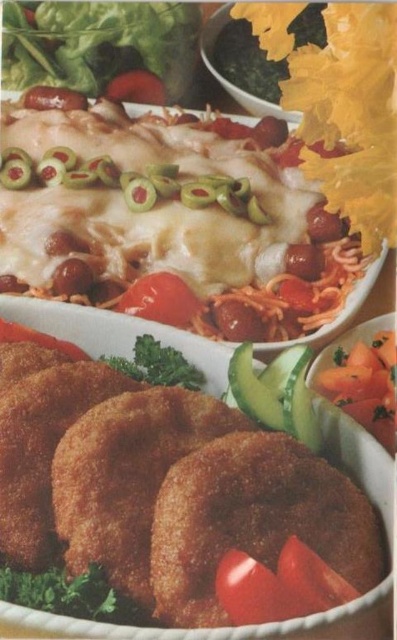
Question: Does green leafy vegetable at upper left lie in front of red glossy tomato at center?

Choices:
 (A) yes
 (B) no

Answer: (B)

Question: Which of the following is the closest to the observer?

Choices:
 (A) (156, 314)
 (B) (15, 3)

Answer: (A)

Question: Can you confirm if green leafy vegetable at upper left is smaller than red glossy tomato at center?

Choices:
 (A) no
 (B) yes

Answer: (A)

Question: Is green leafy vegetable at upper left above red glossy tomato at center?

Choices:
 (A) no
 (B) yes

Answer: (B)

Question: Which object appears closest to the camera in this image?

Choices:
 (A) green leafy vegetable at upper left
 (B) red glossy tomato at center

Answer: (B)